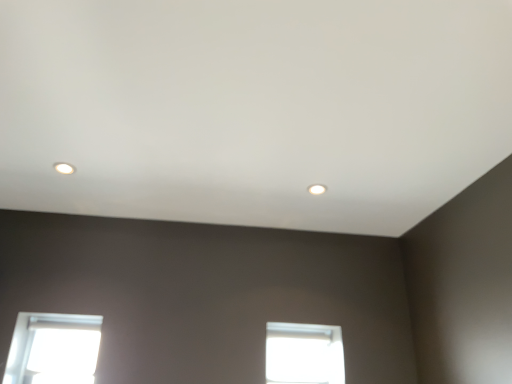
In order to click on transparent glass window at center, which is the second window from left to right in this screenshot , I will do `click(304, 354)`.

Looking at this image, measure the distance between transparent glass window at center, positioned as the 1th window in right-to-left order, and camera.

A distance of 6.85 feet exists between transparent glass window at center, positioned as the 1th window in right-to-left order, and camera.

The image size is (512, 384). What do you see at coordinates (317, 189) in the screenshot?
I see `matte white light fixture at upper center, which ranks as the first lighting in back-to-front order` at bounding box center [317, 189].

Find the location of a particular element. The height and width of the screenshot is (384, 512). transparent glass window at center, which is the second window from left to right is located at coordinates (304, 354).

Image resolution: width=512 pixels, height=384 pixels. I want to click on window that is the 1st object located below the matte white light fixture at upper left, the 2th lighting when ordered from bottom to top (from the image's perspective), so click(x=53, y=349).

Considering the positions of objects transparent glass window at lower left, the 1th window in the left-to-right sequence, and matte white light fixture at upper left, the 2th lighting when ordered from bottom to top, in the image provided, who is behind, transparent glass window at lower left, the 1th window in the left-to-right sequence, or matte white light fixture at upper left, the 2th lighting when ordered from bottom to top,?

transparent glass window at lower left, the 1th window in the left-to-right sequence.

Is transparent glass window at lower left, which is the 2th window in right-to-left order, oriented away from matte white light fixture at upper left, positioned as the first lighting in front-to-back order?

No, transparent glass window at lower left, which is the 2th window in right-to-left order, is not facing away from matte white light fixture at upper left, positioned as the first lighting in front-to-back order.

Can you confirm if transparent glass window at lower left, which is the 2th window in right-to-left order, is positioned to the left of matte white light fixture at upper left, the 2th lighting when ordered from bottom to top?

Yes.

Would you say transparent glass window at lower left, the 1th window in the left-to-right sequence, is part of matte white light fixture at upper left, the 2th lighting positioned from the right,'s contents?

No, transparent glass window at lower left, the 1th window in the left-to-right sequence, is not inside matte white light fixture at upper left, the 2th lighting positioned from the right.

Based on the photo, how many degrees apart are the facing directions of matte white light fixture at upper left, positioned as the second lighting in back-to-front order, and transparent glass window at lower left, the 1th window in the left-to-right sequence?

The angular difference between matte white light fixture at upper left, positioned as the second lighting in back-to-front order, and transparent glass window at lower left, the 1th window in the left-to-right sequence, is 93 degrees.

Which object is wider, matte white light fixture at upper left, positioned as the first lighting in front-to-back order, or transparent glass window at lower left, the 1th window in the left-to-right sequence?

matte white light fixture at upper left, positioned as the first lighting in front-to-back order, is wider.

Is matte white light fixture at upper left, the 2th lighting positioned from the right, turned away from transparent glass window at lower left, which is the 2th window in right-to-left order?

No, matte white light fixture at upper left, the 2th lighting positioned from the right,'s orientation is not away from transparent glass window at lower left, which is the 2th window in right-to-left order.

Does matte white light fixture at upper left, positioned as the second lighting in back-to-front order, have a lesser width compared to matte white light fixture at upper center, which is the 1th lighting from bottom to top?

Correct, the width of matte white light fixture at upper left, positioned as the second lighting in back-to-front order, is less than that of matte white light fixture at upper center, which is the 1th lighting from bottom to top.

Measure the distance between matte white light fixture at upper left, positioned as the second lighting in back-to-front order, and matte white light fixture at upper center, which is the 1th lighting from bottom to top.

matte white light fixture at upper left, positioned as the second lighting in back-to-front order, is 38.89 inches from matte white light fixture at upper center, which is the 1th lighting from bottom to top.

From the image's perspective, is matte white light fixture at upper left, the 1th lighting in the top-to-bottom sequence, above or below matte white light fixture at upper center, which appears as the 1th lighting when viewed from the right?

Clearly, from the image's perspective, matte white light fixture at upper left, the 1th lighting in the top-to-bottom sequence, is above matte white light fixture at upper center, which appears as the 1th lighting when viewed from the right.

From their relative heights in the image, would you say matte white light fixture at upper left, which ranks as the first lighting in left-to-right order, is taller or shorter than matte white light fixture at upper center, positioned as the second lighting in top-to-bottom order?

Considering their sizes, matte white light fixture at upper left, which ranks as the first lighting in left-to-right order, has less height than matte white light fixture at upper center, positioned as the second lighting in top-to-bottom order.

Image resolution: width=512 pixels, height=384 pixels. In order to click on window below the transparent glass window at center, positioned as the 1th window in right-to-left order (from a real-world perspective) in this screenshot , I will do `click(53, 349)`.

From a real-world perspective, which object stands above the other?

From a 3D spatial view, transparent glass window at center, positioned as the 1th window in right-to-left order, is above.

Based on the photo, which object is thinner, transparent glass window at center, which is the second window from left to right, or transparent glass window at lower left, which is the 2th window in right-to-left order?

transparent glass window at center, which is the second window from left to right.

Is transparent glass window at center, which is the second window from left to right, aimed at matte white light fixture at upper center, which appears as the 1th lighting when viewed from the right?

No, transparent glass window at center, which is the second window from left to right, is not aimed at matte white light fixture at upper center, which appears as the 1th lighting when viewed from the right.

From the image's perspective, is transparent glass window at center, positioned as the 1th window in right-to-left order, under matte white light fixture at upper center, which is the second lighting in front-to-back order?

Correct, transparent glass window at center, positioned as the 1th window in right-to-left order, appears lower than matte white light fixture at upper center, which is the second lighting in front-to-back order, in the image.

Based on the photo, does transparent glass window at center, which is the second window from left to right, appear on the right side of matte white light fixture at upper center, which appears as the 1th lighting when viewed from the right?

Incorrect, transparent glass window at center, which is the second window from left to right, is not on the right side of matte white light fixture at upper center, which appears as the 1th lighting when viewed from the right.

Can you confirm if transparent glass window at center, positioned as the 1th window in right-to-left order, is bigger than matte white light fixture at upper center, which is the second lighting in front-to-back order?

Yes.

Is transparent glass window at lower left, the 1th window in the left-to-right sequence, taller than transparent glass window at center, positioned as the 1th window in right-to-left order?

Correct, transparent glass window at lower left, the 1th window in the left-to-right sequence, is much taller as transparent glass window at center, positioned as the 1th window in right-to-left order.

From a real-world perspective, is transparent glass window at lower left, the 1th window in the left-to-right sequence, positioned above or below transparent glass window at center, which is the second window from left to right?

transparent glass window at lower left, the 1th window in the left-to-right sequence, is below transparent glass window at center, which is the second window from left to right.

Is transparent glass window at lower left, which is the 2th window in right-to-left order, positioned beyond the bounds of transparent glass window at center, positioned as the 1th window in right-to-left order?

That's correct, transparent glass window at lower left, which is the 2th window in right-to-left order, is outside of transparent glass window at center, positioned as the 1th window in right-to-left order.

Can you confirm if transparent glass window at lower left, which is the 2th window in right-to-left order, is positioned to the left of transparent glass window at center, positioned as the 1th window in right-to-left order?

Yes, transparent glass window at lower left, which is the 2th window in right-to-left order, is to the left of transparent glass window at center, positioned as the 1th window in right-to-left order.

What's the angular difference between transparent glass window at center, positioned as the 1th window in right-to-left order, and matte white light fixture at upper left, the 2th lighting when ordered from bottom to top,'s facing directions?

There is a 93-degree angle between the facing directions of transparent glass window at center, positioned as the 1th window in right-to-left order, and matte white light fixture at upper left, the 2th lighting when ordered from bottom to top.

Is point (332, 372) behind point (67, 173)?

That is True.

Looking at this image, is transparent glass window at center, positioned as the 1th window in right-to-left order, not within matte white light fixture at upper left, the 2th lighting positioned from the right?

That's correct, transparent glass window at center, positioned as the 1th window in right-to-left order, is outside of matte white light fixture at upper left, the 2th lighting positioned from the right.

Which object is further away from the camera taking this photo, transparent glass window at center, positioned as the 1th window in right-to-left order, or matte white light fixture at upper left, positioned as the second lighting in back-to-front order?

Positioned behind is transparent glass window at center, positioned as the 1th window in right-to-left order.

Image resolution: width=512 pixels, height=384 pixels. Find the location of `lighting that is the 1st object to the right of the transparent glass window at lower left, which is the 2th window in right-to-left order, starting at the anchor`. lighting that is the 1st object to the right of the transparent glass window at lower left, which is the 2th window in right-to-left order, starting at the anchor is located at coordinates (64, 168).

At what (x,y) coordinates should I click in order to perform the action: click on the 2nd lighting directly above the transparent glass window at lower left, which is the 2th window in right-to-left order (from a real-world perspective). Please return your answer as a coordinate pair (x, y). Looking at the image, I should click on (64, 168).

When comparing their distances from transparent glass window at lower left, the 1th window in the left-to-right sequence, does matte white light fixture at upper center, marked as the 2th lighting in a left-to-right arrangement, or transparent glass window at center, positioned as the 1th window in right-to-left order, seem closer?

The object closer to transparent glass window at lower left, the 1th window in the left-to-right sequence, is transparent glass window at center, positioned as the 1th window in right-to-left order.

Looking at the image, which one is located closer to transparent glass window at lower left, the 1th window in the left-to-right sequence, transparent glass window at center, positioned as the 1th window in right-to-left order, or matte white light fixture at upper left, the 2th lighting when ordered from bottom to top?

Based on the image, matte white light fixture at upper left, the 2th lighting when ordered from bottom to top, appears to be nearer to transparent glass window at lower left, the 1th window in the left-to-right sequence.

When comparing their distances from transparent glass window at lower left, the 1th window in the left-to-right sequence, does transparent glass window at center, positioned as the 1th window in right-to-left order, or matte white light fixture at upper center, which is the second lighting in front-to-back order, seem further?

matte white light fixture at upper center, which is the second lighting in front-to-back order, is further to transparent glass window at lower left, the 1th window in the left-to-right sequence.

Consider the image. When comparing their distances from transparent glass window at center, positioned as the 1th window in right-to-left order, does transparent glass window at lower left, which is the 2th window in right-to-left order, or matte white light fixture at upper left, the 2th lighting when ordered from bottom to top, seem closer?

Based on the image, transparent glass window at lower left, which is the 2th window in right-to-left order, appears to be nearer to transparent glass window at center, positioned as the 1th window in right-to-left order.

Considering their positions, is matte white light fixture at upper left, the 1th lighting in the top-to-bottom sequence, positioned closer to transparent glass window at center, positioned as the 1th window in right-to-left order, than transparent glass window at lower left, the 1th window in the left-to-right sequence?

transparent glass window at lower left, the 1th window in the left-to-right sequence, lies closer to transparent glass window at center, positioned as the 1th window in right-to-left order, than the other object.

From the image, which object appears to be nearer to matte white light fixture at upper left, positioned as the second lighting in back-to-front order, transparent glass window at lower left, the 1th window in the left-to-right sequence, or transparent glass window at center, positioned as the 1th window in right-to-left order?

Based on the image, transparent glass window at lower left, the 1th window in the left-to-right sequence, appears to be nearer to matte white light fixture at upper left, positioned as the second lighting in back-to-front order.

Estimate the real-world distances between objects in this image. Which object is further from transparent glass window at center, which is the second window from left to right, matte white light fixture at upper center, which is the 1th lighting from bottom to top, or matte white light fixture at upper left, the 1th lighting in the top-to-bottom sequence?

matte white light fixture at upper left, the 1th lighting in the top-to-bottom sequence, lies further to transparent glass window at center, which is the second window from left to right, than the other object.

Which object lies nearer to the anchor point matte white light fixture at upper center, positioned as the second lighting in top-to-bottom order, transparent glass window at lower left, the 1th window in the left-to-right sequence, or matte white light fixture at upper left, positioned as the first lighting in front-to-back order?

matte white light fixture at upper left, positioned as the first lighting in front-to-back order.

This screenshot has width=512, height=384. Identify the location of window located between matte white light fixture at upper left, the 2th lighting when ordered from bottom to top, and matte white light fixture at upper center, which appears as the 1th lighting when viewed from the right, in the left-right direction. pos(304,354).

The image size is (512, 384). I want to click on window between transparent glass window at lower left, the 1th window in the left-to-right sequence, and matte white light fixture at upper center, which ranks as the first lighting in back-to-front order, from left to right, so click(304, 354).

Locate an element on the screen. lighting between transparent glass window at lower left, which is the 2th window in right-to-left order, and transparent glass window at center, positioned as the 1th window in right-to-left order, from left to right is located at coordinates (64, 168).

The height and width of the screenshot is (384, 512). I want to click on lighting located between transparent glass window at lower left, the 1th window in the left-to-right sequence, and matte white light fixture at upper center, positioned as the second lighting in top-to-bottom order, in the left-right direction, so click(x=64, y=168).